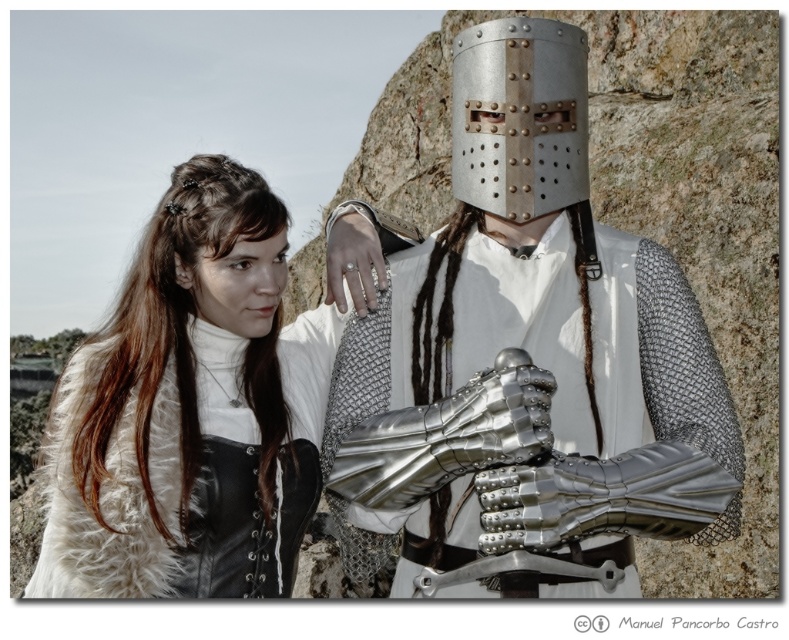
Is metallic chainmail armor at center wider than white fur vest at upper left?

Incorrect, metallic chainmail armor at center's width does not surpass white fur vest at upper left's.

Looking at this image, is metallic chainmail armor at center above white fur vest at upper left?

Yes.

Identify the location of metallic chainmail armor at center. (533, 353).

The width and height of the screenshot is (789, 640). In order to click on metallic chainmail armor at center in this screenshot , I will do `click(533, 353)`.